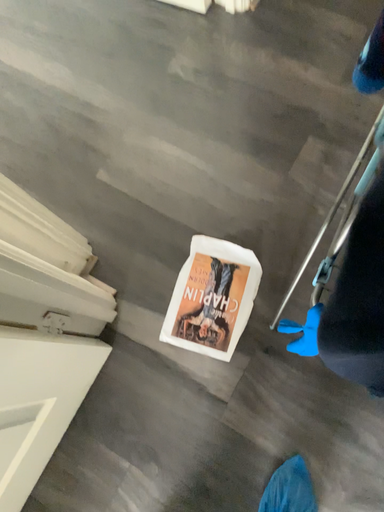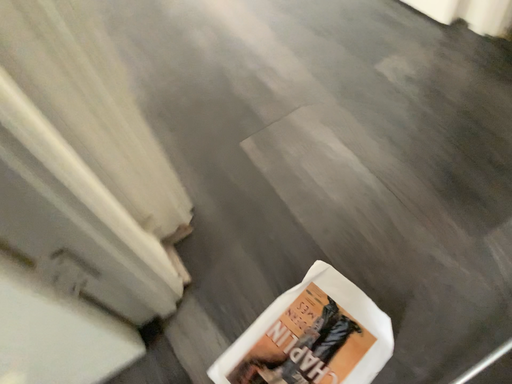
Question: How did the camera likely rotate when shooting the video?

Choices:
 (A) rotated downward
 (B) rotated upward

Answer: (B)